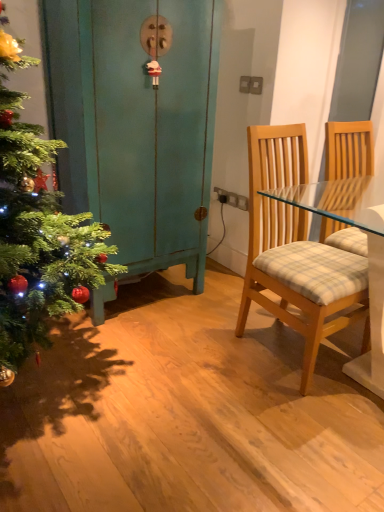
Where is `free space underneath light wood/glass chair at right (from a real-world perspective)`? free space underneath light wood/glass chair at right (from a real-world perspective) is located at coordinates (288, 349).